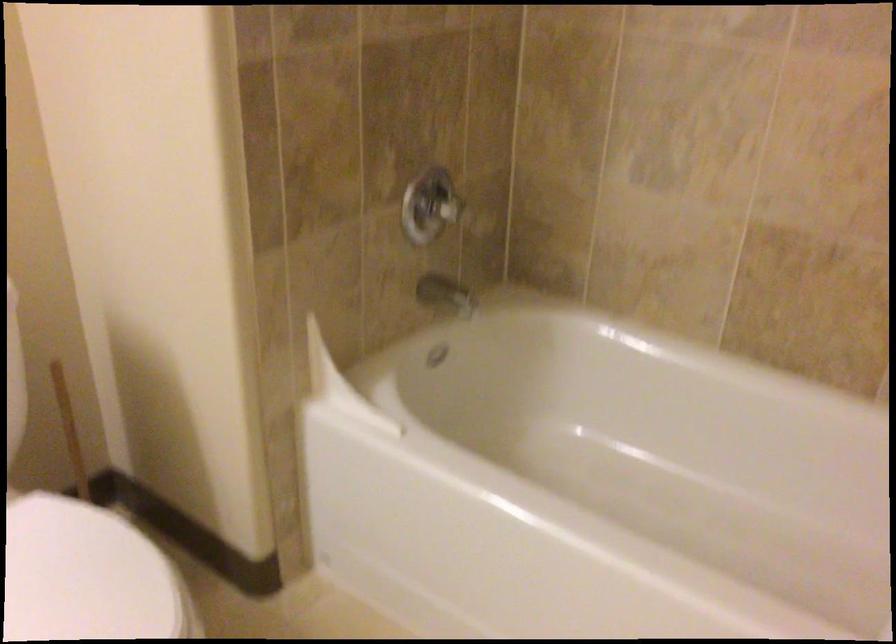
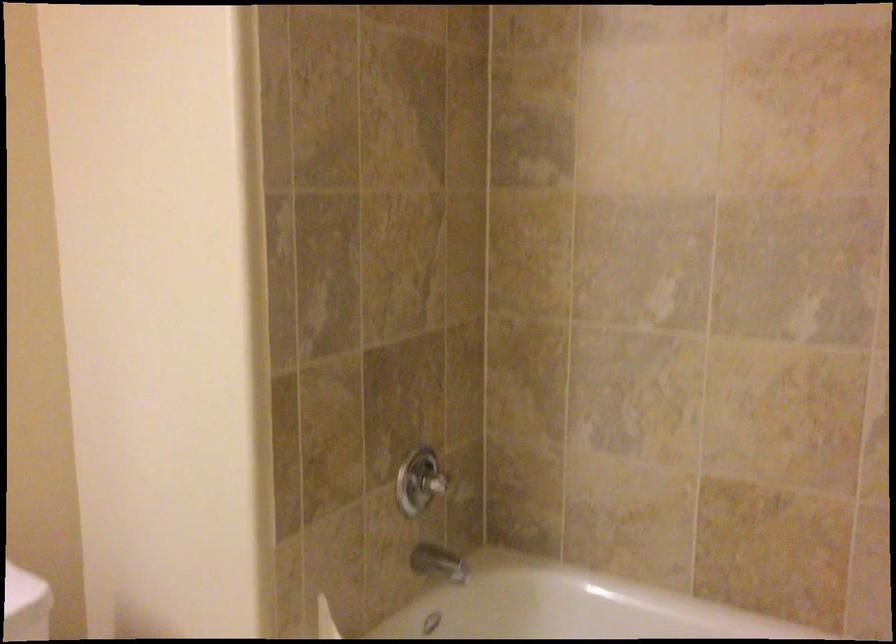
Consider the image. Which direction would the cameraman need to move to produce the second image?

The cameraman moved toward left, backward.